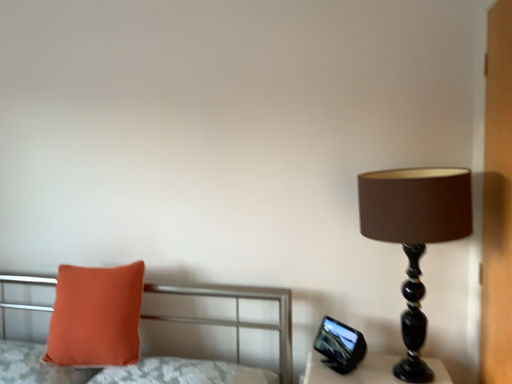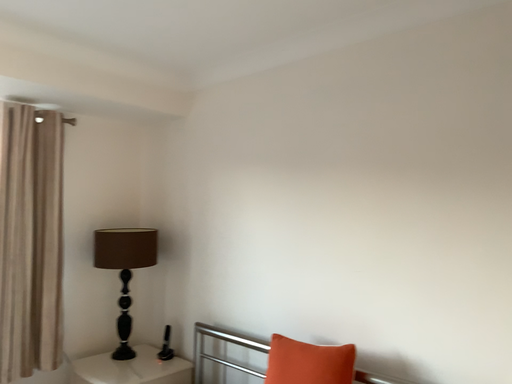
Question: Which way did the camera rotate in the video?

Choices:
 (A) rotated upward
 (B) rotated downward

Answer: (A)